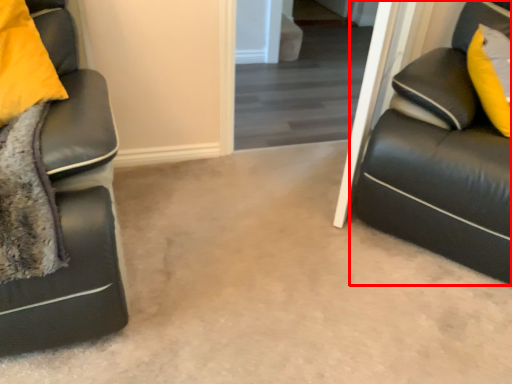
Question: Observing the image, what is the correct spatial positioning of studio couch (annotated by the red box) in reference to glass door?

Choices:
 (A) right
 (B) left

Answer: (A)